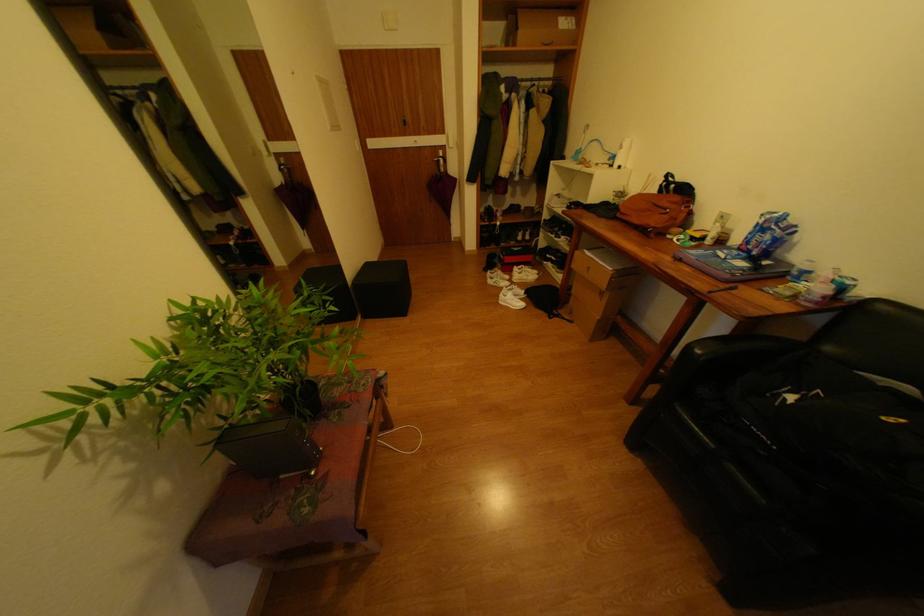
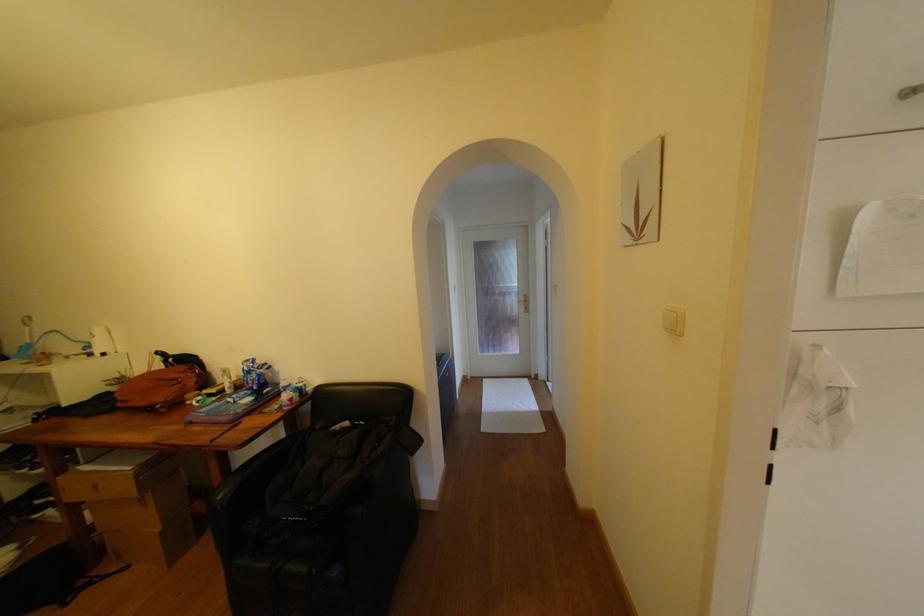
Locate, in the second image, the point that corresponds to pixel 686 199 in the first image.

(190, 369)